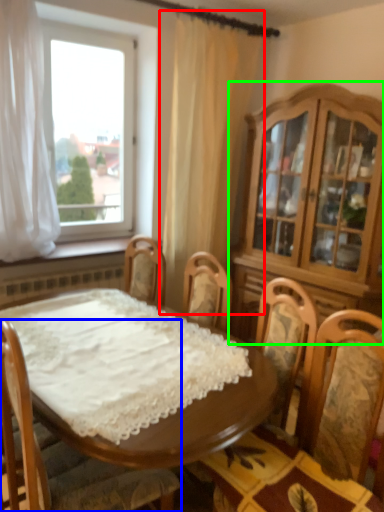
Question: Which is farther away from curtain (highlighted by a red box)? chair (highlighted by a blue box) or cabinetry (highlighted by a green box)?

Choices:
 (A) chair
 (B) cabinetry

Answer: (A)